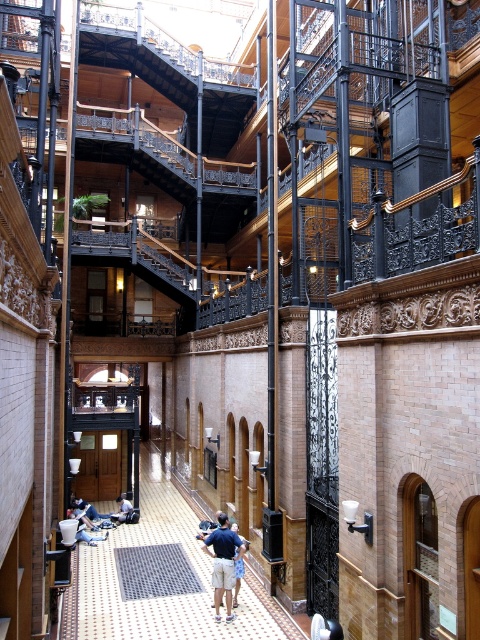
Is polished wood corridor at center to the right of blue denim jeans at center from the viewer's perspective?

Indeed, polished wood corridor at center is positioned on the right side of blue denim jeans at center.

At what (x,y) coordinates should I click in order to perform the action: click on polished wood corridor at center. Please return your answer as a coordinate pair (x, y). The height and width of the screenshot is (640, 480). Looking at the image, I should click on (168, 593).

Between polished wood corridor at center and blue denim shorts at center, which one has more height?

Standing taller between the two is blue denim shorts at center.

Does polished wood corridor at center appear on the left side of blue denim shorts at center?

Correct, you'll find polished wood corridor at center to the left of blue denim shorts at center.

The image size is (480, 640). Identify the location of polished wood corridor at center. (168, 593).

Between point (236, 554) and point (120, 508), which one is positioned in front?

Point (236, 554) is in front.

The height and width of the screenshot is (640, 480). What do you see at coordinates (224, 563) in the screenshot? I see `blue denim shorts at center` at bounding box center [224, 563].

Image resolution: width=480 pixels, height=640 pixels. What do you see at coordinates (224, 563) in the screenshot? I see `blue denim shorts at center` at bounding box center [224, 563].

The image size is (480, 640). I want to click on blue denim shorts at center, so (x=224, y=563).